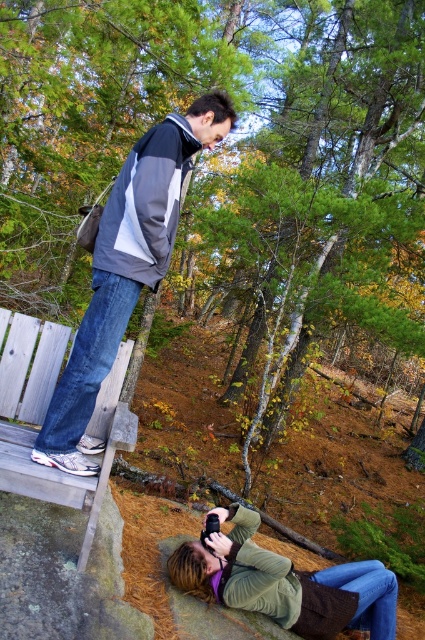
Question: Which point appears farthest from the camera in this image?

Choices:
 (A) (282, 573)
 (B) (56, 353)
 (C) (152, 188)

Answer: (B)

Question: Does green fuzzy jacket at lower center lie in front of gray wood bench at lower left?

Choices:
 (A) no
 (B) yes

Answer: (A)

Question: Which point is closer to the camera taking this photo?

Choices:
 (A) (68, 401)
 (B) (42, 369)

Answer: (A)

Question: Which of the following is the closest to the observer?

Choices:
 (A) gray wood bench at lower left
 (B) gray/white jacket at center
 (C) green fuzzy jacket at lower center

Answer: (A)

Question: Can you confirm if gray/white jacket at center is positioned below gray wood bench at lower left?

Choices:
 (A) yes
 (B) no

Answer: (B)

Question: Is gray/white jacket at center wider than gray wood bench at lower left?

Choices:
 (A) yes
 (B) no

Answer: (A)